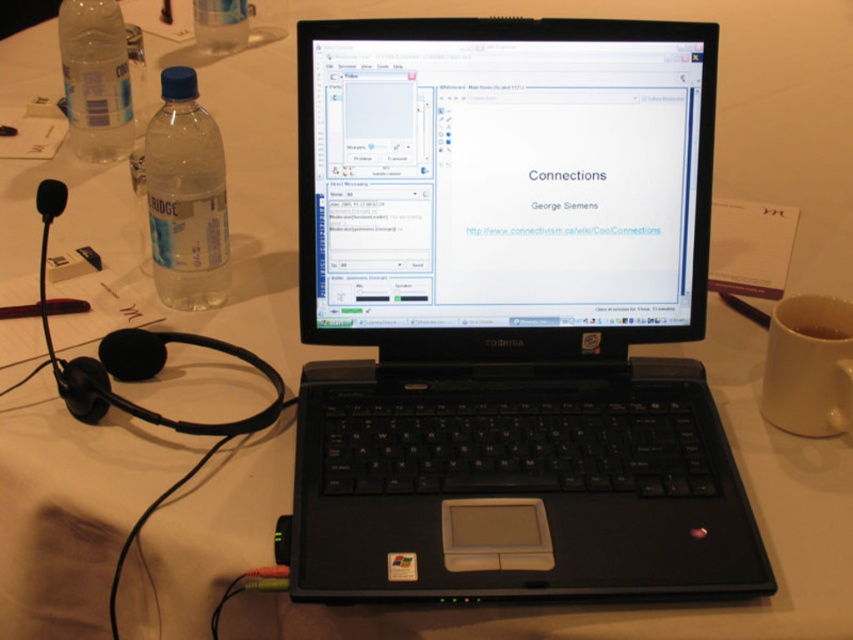
Between black plastic laptop at center and clear plastic bottle at upper left, which one is positioned lower?

Positioned lower is black plastic laptop at center.

Measure the distance between black plastic laptop at center and camera.

black plastic laptop at center and camera are 26.48 inches apart from each other.

Is point (317, 484) farther from viewer compared to point (113, 150)?

No.

At what (x,y) coordinates should I click in order to perform the action: click on black plastic laptop at center. Please return your answer as a coordinate pair (x, y). The height and width of the screenshot is (640, 853). Looking at the image, I should click on [509, 314].

Is clear plastic bottle at left above clear plastic bottle at upper left?

No.

Does clear plastic bottle at left have a larger size compared to clear plastic bottle at upper left?

Correct, clear plastic bottle at left is larger in size than clear plastic bottle at upper left.

The height and width of the screenshot is (640, 853). Find the location of `clear plastic bottle at left`. clear plastic bottle at left is located at coordinates (186, 196).

This screenshot has width=853, height=640. In order to click on clear plastic bottle at left in this screenshot , I will do `click(186, 196)`.

Is black plastic laptop at center to the left of clear plastic bottle at left from the viewer's perspective?

Incorrect, black plastic laptop at center is not on the left side of clear plastic bottle at left.

Measure the distance between point [698,432] and camera.

Point [698,432] and camera are 32.56 inches apart.

Does point (518, 115) lie in front of point (167, 141)?

Yes, point (518, 115) is closer to viewer.

Where is `black plastic laptop at center`? black plastic laptop at center is located at coordinates (509, 314).